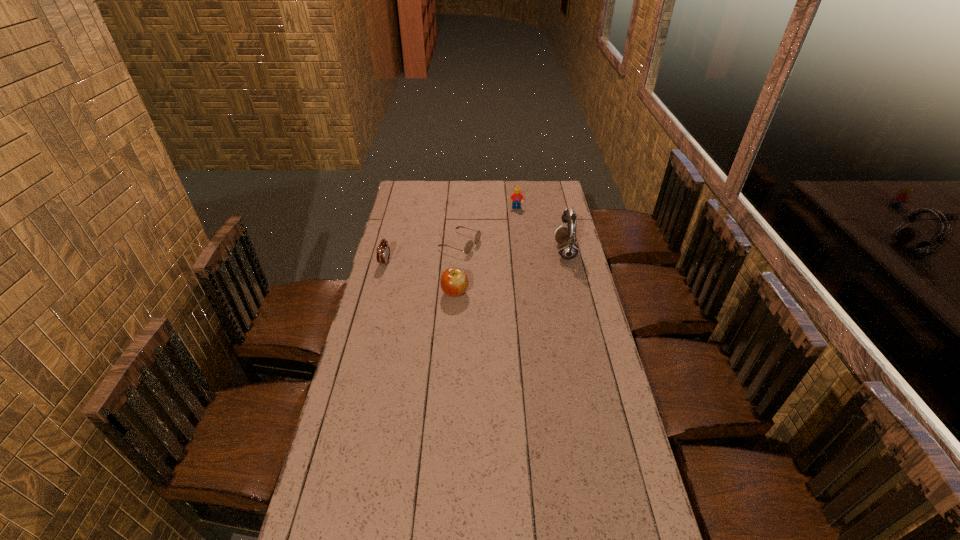
In the image, there is a desktop. Where is `vacant space at the near edge`? vacant space at the near edge is located at coordinates (373, 529).

The width and height of the screenshot is (960, 540). I want to click on vacant space at the left edge of the desktop, so click(383, 370).

The width and height of the screenshot is (960, 540). I want to click on vacant space at the right edge of the desktop, so click(x=556, y=249).

Image resolution: width=960 pixels, height=540 pixels. I want to click on vacant space at the far left corner of the desktop, so click(x=409, y=192).

I want to click on unoccupied area between the tallest object and the apple, so click(x=510, y=272).

Locate an element on the screen. The image size is (960, 540). free area in between the alarm clock and the sunglasses is located at coordinates (422, 253).

Identify the location of free area in between the fourth object from left to right and the rightmost object. Image resolution: width=960 pixels, height=540 pixels. [x=540, y=230].

This screenshot has width=960, height=540. I want to click on free space between the shortest object and the tallest object, so coord(513,248).

The width and height of the screenshot is (960, 540). I want to click on vacant space in between the sunglasses and the leftmost object, so click(x=422, y=253).

At what (x,y) coordinates should I click in order to perform the action: click on vacant area that lies between the leftmost object and the shortest object. Please return your answer as a coordinate pair (x, y). Image resolution: width=960 pixels, height=540 pixels. Looking at the image, I should click on (422, 253).